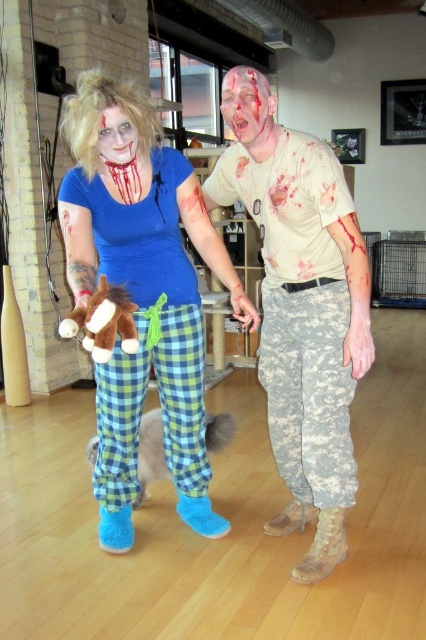
Question: Which object appears farthest from the camera in this image?

Choices:
 (A) brown plush toy at center
 (B) matte white face at center
 (C) matte white face at upper left
 (D) camouflage pants at center

Answer: (B)

Question: Can you confirm if camouflage pants at center is wider than brown plush toy at center?

Choices:
 (A) yes
 (B) no

Answer: (A)

Question: Which point appears closest to the camera in this image?

Choices:
 (A) (267, 364)
 (B) (259, 115)
 (C) (181, 445)

Answer: (B)

Question: Can you confirm if green plaid pajama pants at center is positioned below brown plush toy at center?

Choices:
 (A) no
 (B) yes

Answer: (B)

Question: Does green plaid pajama pants at center have a greater width compared to fluffy fur cat at lower center?

Choices:
 (A) no
 (B) yes

Answer: (A)

Question: Which object is the farthest from the blue flannel pajama pants at center?

Choices:
 (A) fluffy fur cat at lower center
 (B) camouflage pants at center

Answer: (A)